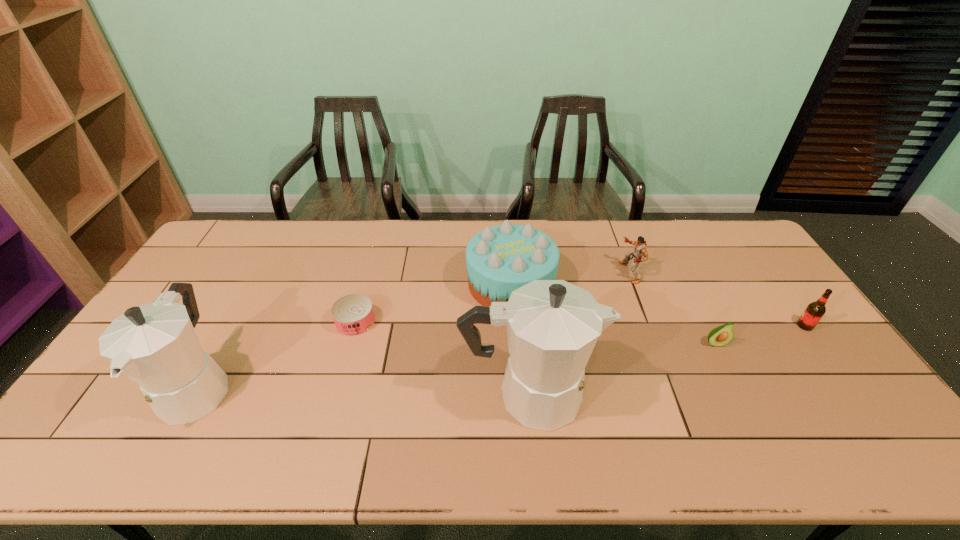
This screenshot has width=960, height=540. Find the location of `the second tallest object`. the second tallest object is located at coordinates (155, 345).

Find the location of a particular element. the shorter coffeepot is located at coordinates (155, 345).

Image resolution: width=960 pixels, height=540 pixels. What are the coordinates of `the taller coffeepot` in the screenshot? It's located at [552, 326].

At what (x,y) coordinates should I click in order to perform the action: click on the tallest object. Please return your answer as a coordinate pair (x, y). The height and width of the screenshot is (540, 960). Looking at the image, I should click on (552, 326).

Locate an element on the screen. puncher is located at coordinates (640, 249).

Locate an element on the screen. The width and height of the screenshot is (960, 540). the second shortest object is located at coordinates (720, 336).

Image resolution: width=960 pixels, height=540 pixels. Find the location of `avocado`. avocado is located at coordinates (720, 336).

Find the location of a particular element. the sixth object from right to left is located at coordinates (353, 315).

Locate an element on the screen. The height and width of the screenshot is (540, 960). can is located at coordinates (353, 315).

Locate an element on the screen. The width and height of the screenshot is (960, 540). root beer is located at coordinates (813, 313).